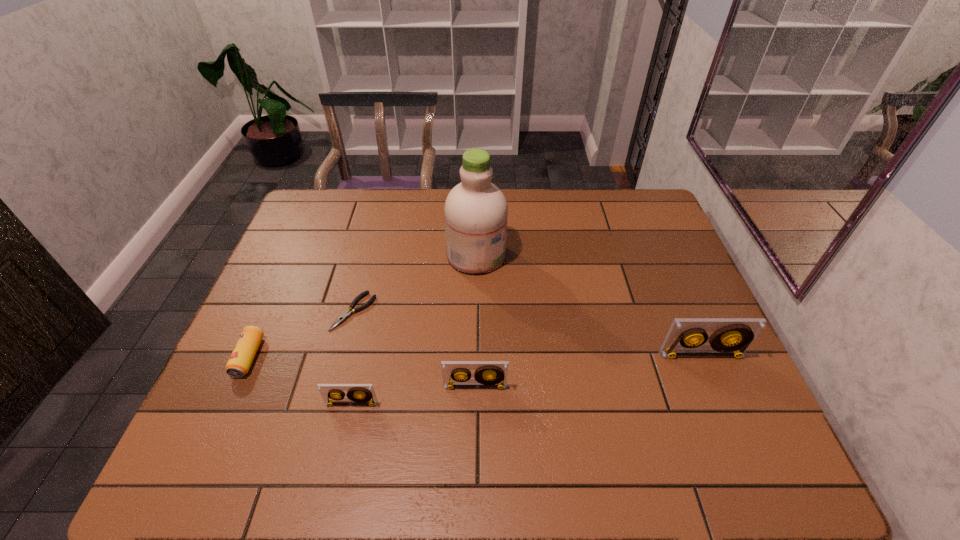
Identify the location of vacant space that's between the fourth shortest object and the cleansing agent. (475, 321).

Find the location of a particular element. free spot between the cleansing agent and the rightmost videotape is located at coordinates (588, 305).

Identify the location of blank region between the fourth shortest object and the tallest object. Image resolution: width=960 pixels, height=540 pixels. (475, 321).

Locate an element on the screen. vacant space that's between the leftmost object and the second tallest videotape is located at coordinates (362, 372).

Where is `vacant space that's between the tallest object and the third tallest object`? This screenshot has height=540, width=960. vacant space that's between the tallest object and the third tallest object is located at coordinates (475, 321).

At what (x,y) coordinates should I click in order to perform the action: click on vacant space in between the tallest object and the fifth nearest object. Please return your answer as a coordinate pair (x, y). The height and width of the screenshot is (540, 960). Looking at the image, I should click on (415, 284).

Image resolution: width=960 pixels, height=540 pixels. What are the coordinates of `object that is the second nearest to the nearest object` in the screenshot? It's located at (349, 312).

Image resolution: width=960 pixels, height=540 pixels. What are the coordinates of `object that ranks as the third closest to the second videotape from left to right` in the screenshot? It's located at (476, 211).

Find the location of `videotape object that ranks as the closest to the rightmost object`. videotape object that ranks as the closest to the rightmost object is located at coordinates (488, 374).

Find the location of a particular element. This screenshot has width=960, height=540. videotape that is the second closest to the leftmost videotape is located at coordinates (732, 337).